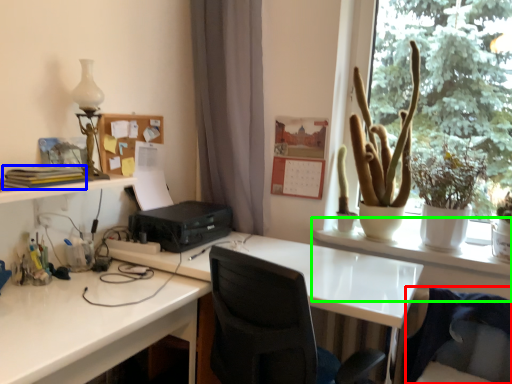
Question: Which object is the farthest from swivel chair (highlighted by a red box)? Choose among these: book (highlighted by a blue box) or table (highlighted by a green box).

Choices:
 (A) book
 (B) table

Answer: (A)